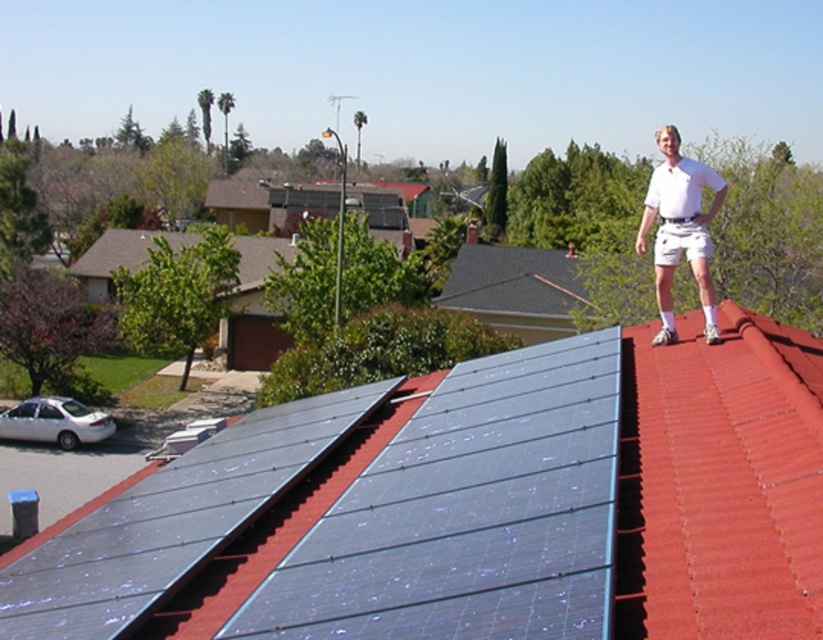
You are a drone operator trying to capture a photo of the blue glossy solar panel at center from above. Given that the drone must stay within the rectangular area defined by coordinates from 0.6 to 0.9 on the x and y axes, can the drone capture the solar panel at its current position?

The blue glossy solar panel at center is located at point (468, 513), which falls within the rectangular area defined by 0.6 to 0.9 on both x and y axes. Therefore, the drone can capture the solar panel at its current position.

You are standing on the ground looking at the blue metallic solar panels at upper center. If you have a 6.5 meter long ladder, will it be sufficient to reach the solar panels?

The blue metallic solar panels at upper center are 6.75 meters away from the viewer. Since the ladder is only 6.5 meters long, it will not be long enough to reach the solar panels.